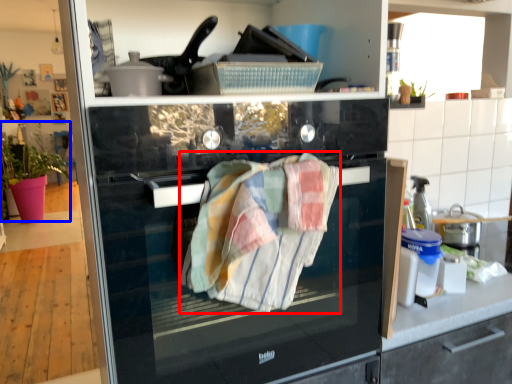
Question: Which of the following is the closest to the observer, bath towel (highlighted by a red box) or plant (highlighted by a blue box)?

Choices:
 (A) bath towel
 (B) plant

Answer: (A)